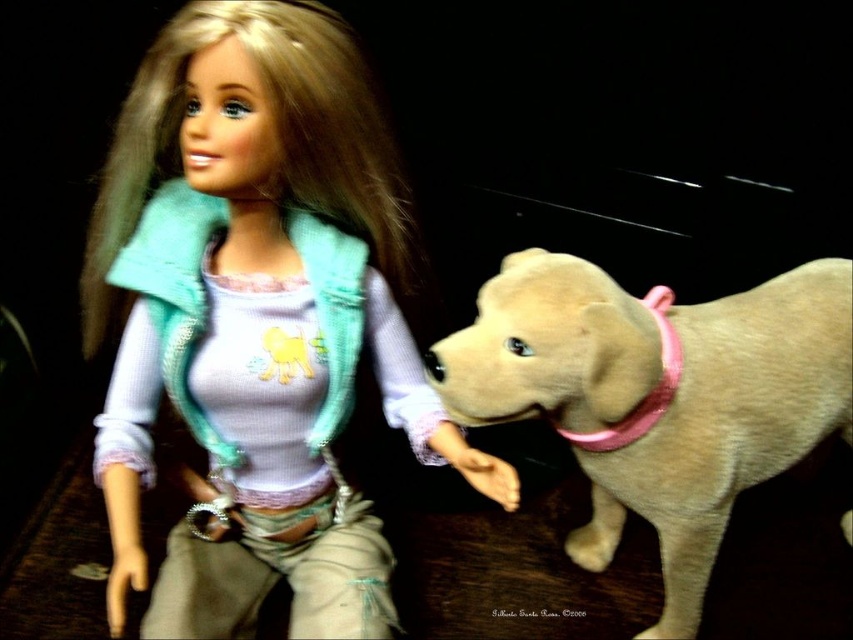
Question: Among these objects, which one is nearest to the camera?

Choices:
 (A) light beige plush dog at center
 (B) matte teal vest at upper left

Answer: (B)

Question: Does matte teal vest at upper left appear on the right side of light beige plush dog at center?

Choices:
 (A) yes
 (B) no

Answer: (B)

Question: Does matte teal vest at upper left have a larger size compared to light beige plush dog at center?

Choices:
 (A) no
 (B) yes

Answer: (B)

Question: Can you confirm if matte teal vest at upper left is thinner than light beige plush dog at center?

Choices:
 (A) yes
 (B) no

Answer: (A)